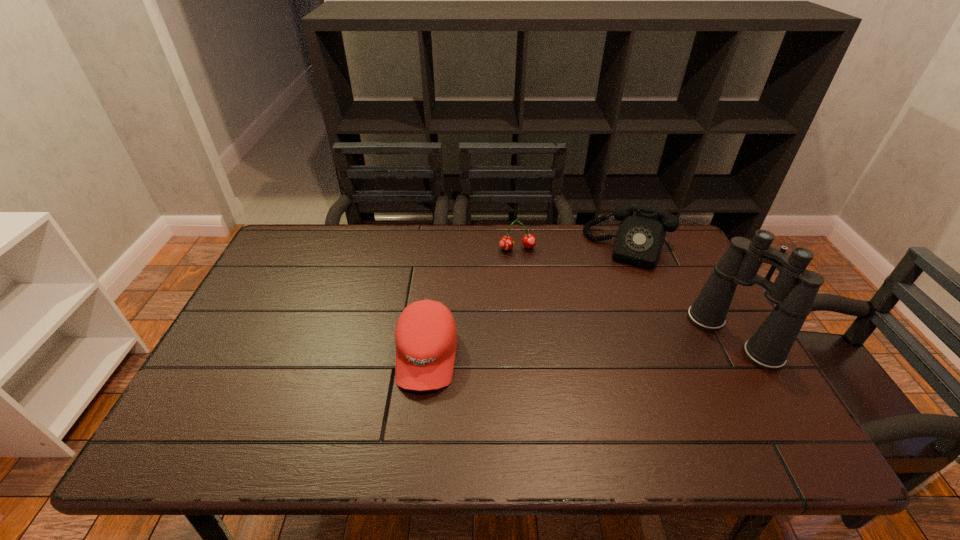
I want to click on blank region between the cap and the tallest object, so click(580, 346).

The image size is (960, 540). I want to click on vacant space that's between the binoculars and the cherry, so click(x=625, y=293).

Identify the location of object that is the second closest one to the telephone. (506, 243).

Point out which object is positioned as the third nearest to the second object from left to right. Please provide its 2D coordinates. Your answer should be formatted as a tuple, i.e. [(x, y)], where the tuple contains the x and y coordinates of a point satisfying the conditions above.

[(793, 292)]

This screenshot has height=540, width=960. What are the coordinates of `free location that satisfies the following two spatial constraints: 1. on the front side of the binoculars; 2. on the right side of the cherry` in the screenshot? It's located at (527, 337).